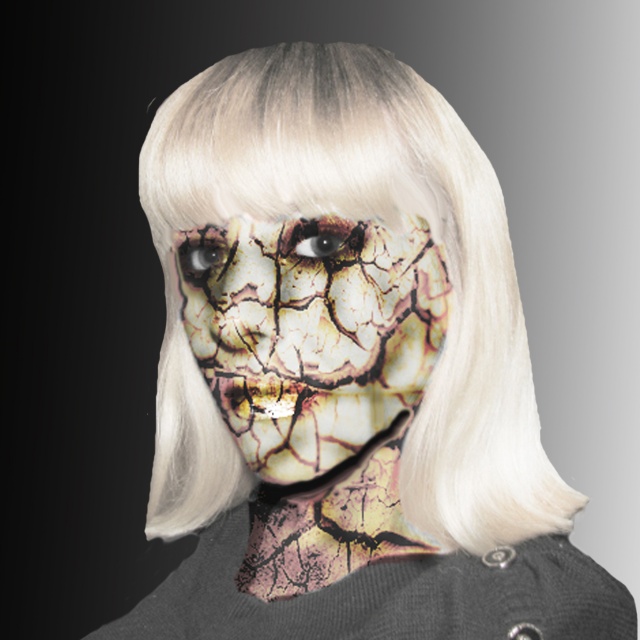
Can you confirm if cracked clay mask at center is smaller than brown textured eye at center?

Incorrect, cracked clay mask at center is not smaller in size than brown textured eye at center.

Can you confirm if cracked clay mask at center is positioned to the right of brown textured eye at center?

Indeed, cracked clay mask at center is positioned on the right side of brown textured eye at center.

The width and height of the screenshot is (640, 640). What are the coordinates of `cracked clay mask at center` in the screenshot? It's located at (317, 340).

Is blonde synthetic wig at center wider than cracked clay mask at center?

Correct, the width of blonde synthetic wig at center exceeds that of cracked clay mask at center.

Where is `blonde synthetic wig at center`? This screenshot has width=640, height=640. blonde synthetic wig at center is located at coordinates (353, 218).

Which of these two, brown textured eye at center or shiny black eye at center, stands shorter?

brown textured eye at center

Can you confirm if brown textured eye at center is wider than shiny black eye at center?

Correct, the width of brown textured eye at center exceeds that of shiny black eye at center.

Who is more forward, (355, 246) or (216, 262)?

Point (355, 246) is more forward.

At what (x,y) coordinates should I click in order to perform the action: click on brown textured eye at center. Please return your answer as a coordinate pair (x, y). The image size is (640, 640). Looking at the image, I should click on (323, 237).